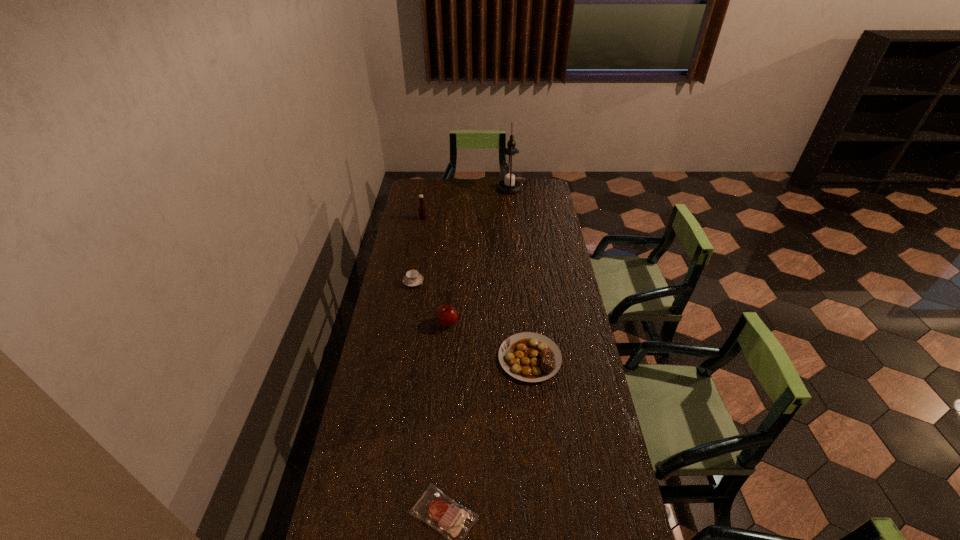
In order to click on free space located on the back of the second farthest object in this screenshot , I will do `click(425, 203)`.

This screenshot has width=960, height=540. Find the location of `free space located on the front of the third nearest object`. free space located on the front of the third nearest object is located at coordinates (441, 407).

I want to click on free point located on the side with the handle of the third farthest object, so click(421, 237).

At what (x,y) coordinates should I click in order to perform the action: click on free location located 0.150m on the side with the handle of the third farthest object. Please return your answer as a coordinate pair (x, y). Looking at the image, I should click on (x=419, y=255).

The image size is (960, 540). I want to click on blank area located on the side with the handle of the third farthest object, so click(422, 228).

Identify the location of free space located 0.060m on the left of the taller steak. 482,358.

The width and height of the screenshot is (960, 540). Identify the location of object positioned at the far edge. (510, 171).

This screenshot has width=960, height=540. In order to click on Tabasco sauce located at the left edge in this screenshot , I will do `click(421, 208)`.

Find the location of a particular element. This screenshot has height=540, width=960. teacup located in the left edge section of the desktop is located at coordinates (412, 278).

You are a GUI agent. You are given a task and a screenshot of the screen. Output one action in this format:
    pyautogui.click(x=<x>, y=<y>)
    Task: Click on the object positioned at the right edge
    This screenshot has width=960, height=540.
    Given the screenshot: What is the action you would take?
    pyautogui.click(x=530, y=357)